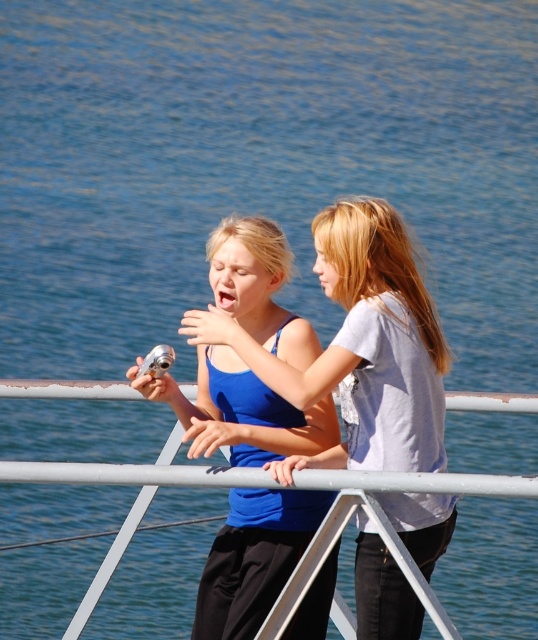
Can you confirm if blue matte tank top at center is positioned to the right of metallic gray rail at center?

Yes, blue matte tank top at center is to the right of metallic gray rail at center.

Can you confirm if blue matte tank top at center is positioned below metallic gray rail at center?

Incorrect, blue matte tank top at center is not positioned below metallic gray rail at center.

Who is more forward, (x=306, y=403) or (x=91, y=394)?

Point (x=306, y=403) is in front.

This screenshot has height=640, width=538. Find the location of `blue matte tank top at center`. blue matte tank top at center is located at coordinates (362, 346).

Consider the image. Between blue matte tank top at center and matte blue tank top at center, which one appears on the right side from the viewer's perspective?

From the viewer's perspective, blue matte tank top at center appears more on the right side.

Locate an element on the screen. The height and width of the screenshot is (640, 538). blue matte tank top at center is located at coordinates (x=362, y=346).

Can you confirm if matte blue tank top at center is wider than metallic gray rail at center?

In fact, matte blue tank top at center might be narrower than metallic gray rail at center.

Who is more distant from viewer, (287, 561) or (336, 484)?

Positioned behind is point (287, 561).

You are a GUI agent. You are given a task and a screenshot of the screen. Output one action in this format:
    pyautogui.click(x=<x>, y=<y>)
    Task: Click on the matte blue tank top at center
    The width and height of the screenshot is (538, 640).
    Given the screenshot: What is the action you would take?
    pyautogui.click(x=253, y=557)